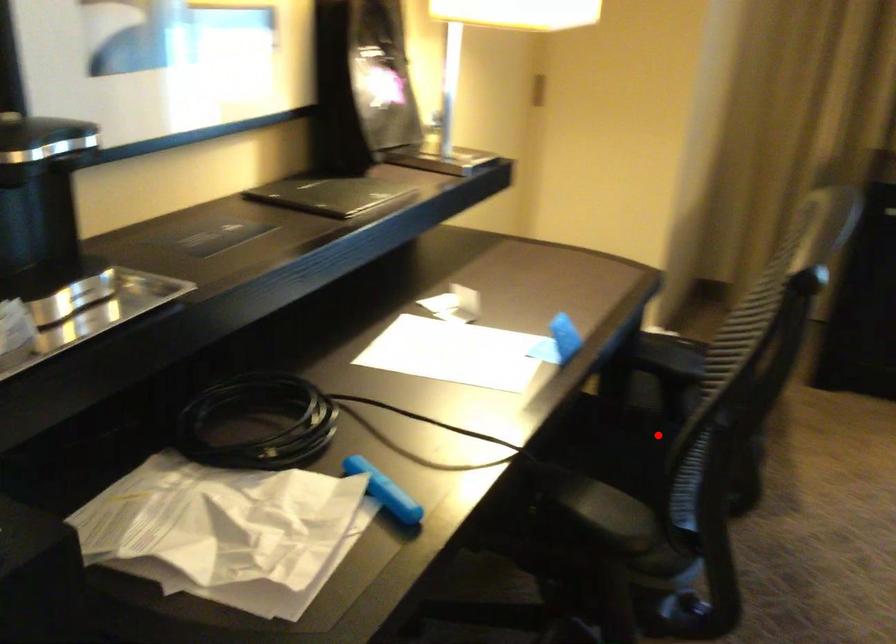
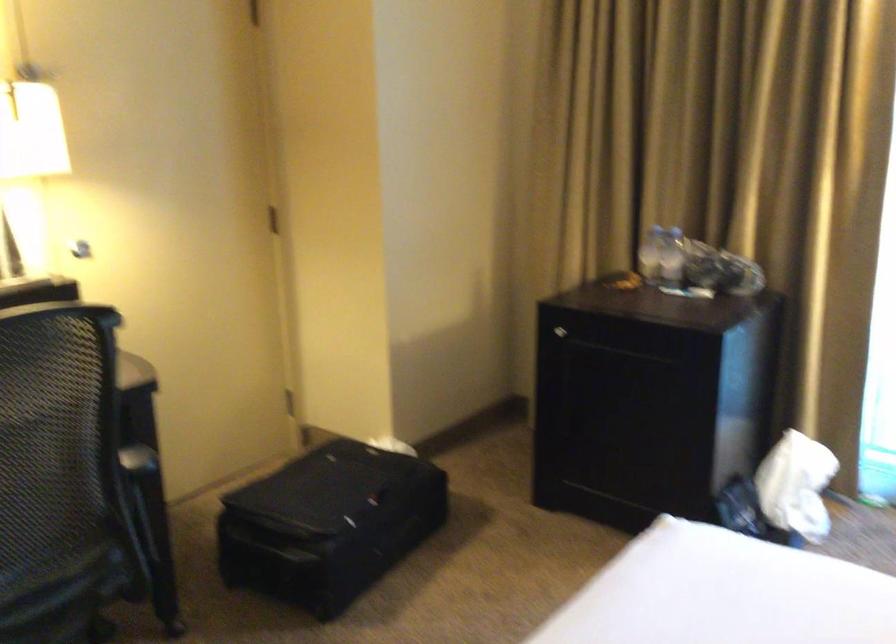
Question: I am providing you with two images of the same scene from different viewpoints. A red point is shown in image1. For the corresponding object point in image2, is it positioned nearer or farther from the camera?

Choices:
 (A) Nearer
 (B) Farther

Answer: (B)